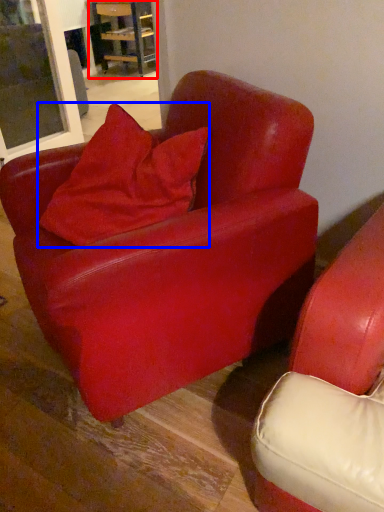
Question: Among these objects, which one is nearest to the camera, table (highlighted by a red box) or pillow (highlighted by a blue box)?

Choices:
 (A) table
 (B) pillow

Answer: (B)